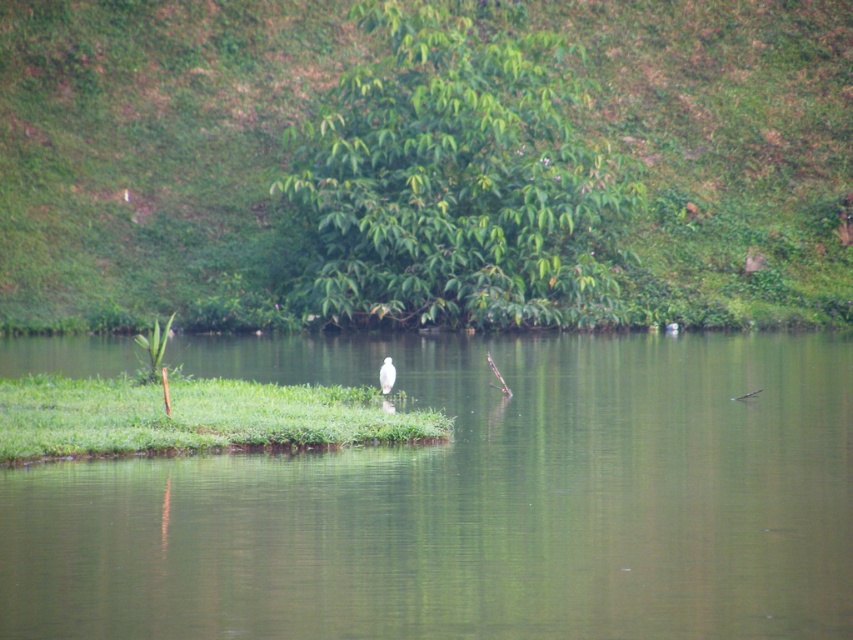
Question: Which of the following is the farthest from the observer?

Choices:
 (A) [25, 401]
 (B) [527, 410]
 (C) [459, 193]

Answer: (C)

Question: Can you confirm if green smooth water at center is positioned to the left of green leafy tree at upper center?

Choices:
 (A) yes
 (B) no

Answer: (B)

Question: Can you confirm if green leafy hillside at center is wider than white matte bird at center?

Choices:
 (A) no
 (B) yes

Answer: (B)

Question: Is green leafy hillside at center to the right of white matte bird at center from the viewer's perspective?

Choices:
 (A) yes
 (B) no

Answer: (A)

Question: Which is nearer to the green leafy hillside at center?

Choices:
 (A) white matte bird at center
 (B) green leafy tree at upper center
 (C) green grass at center

Answer: (B)

Question: Which point appears closest to the camera in this image?

Choices:
 (A) (479, 582)
 (B) (448, 236)

Answer: (A)